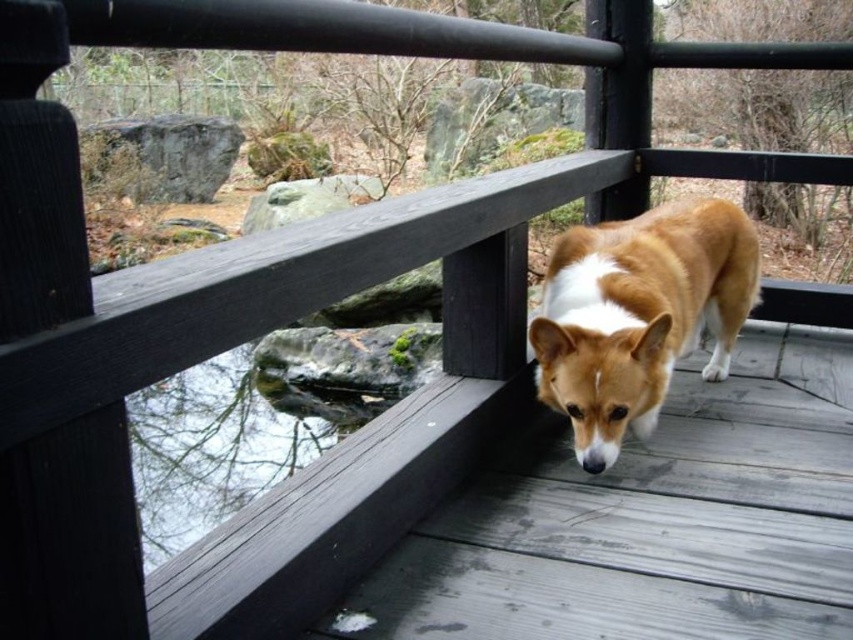
Question: Is wooden deck at center further to the viewer compared to brown/white fur dog at center?

Choices:
 (A) yes
 (B) no

Answer: (B)

Question: Which of the following is the closest to the observer?

Choices:
 (A) wooden deck at center
 (B) brown/white fur dog at center

Answer: (A)

Question: Observing the image, what is the correct spatial positioning of wooden deck at center in reference to brown/white fur dog at center?

Choices:
 (A) below
 (B) above

Answer: (A)

Question: Which of the following is the closest to the observer?

Choices:
 (A) wooden deck at center
 (B) brown/white fur dog at center

Answer: (A)

Question: Is the position of wooden deck at center less distant than that of brown/white fur dog at center?

Choices:
 (A) no
 (B) yes

Answer: (B)